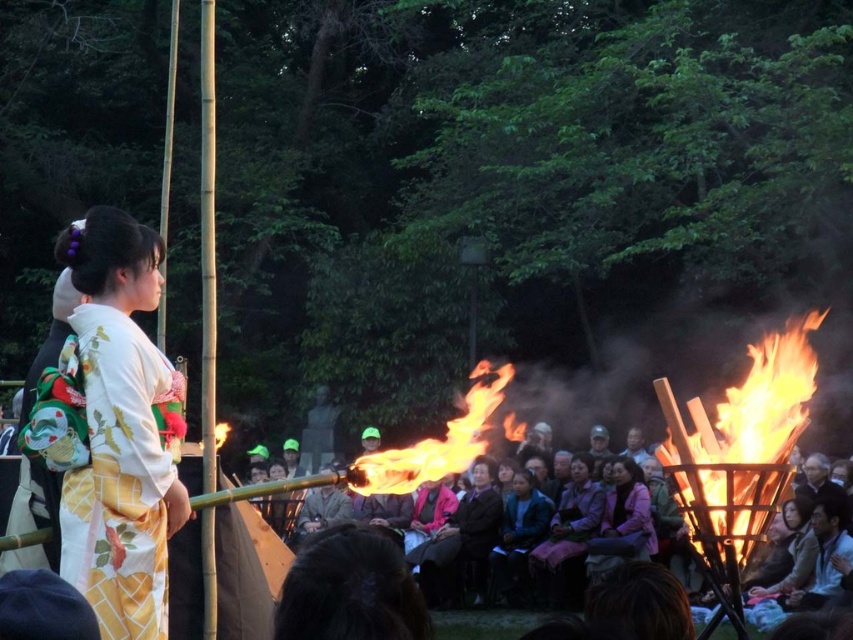
Question: Is pink fabric kimono at center to the right of pink fabric at center from the viewer's perspective?

Choices:
 (A) no
 (B) yes

Answer: (A)

Question: Considering the real-world distances, which object is farthest from the dark brown leather jacket at center?

Choices:
 (A) bright orange flames at right
 (B) white silk kimono at left

Answer: (B)

Question: Does flamematerial/texture at center appear on the right side of pink fabric at center?

Choices:
 (A) no
 (B) yes

Answer: (A)

Question: Which of the following is the farthest from the observer?

Choices:
 (A) flamematerial/texture at center
 (B) white silk kimono at left
 (C) blue fabric jacket at center
 (D) pink fabric at center

Answer: (C)

Question: Observing the image, what is the correct spatial positioning of bright orange flames at right in reference to pink fabric kimono at center?

Choices:
 (A) above
 (B) below

Answer: (A)

Question: Which point appears closest to the camera in this image?

Choices:
 (A) (566, 563)
 (B) (512, 426)
 (C) (509, 572)

Answer: (B)